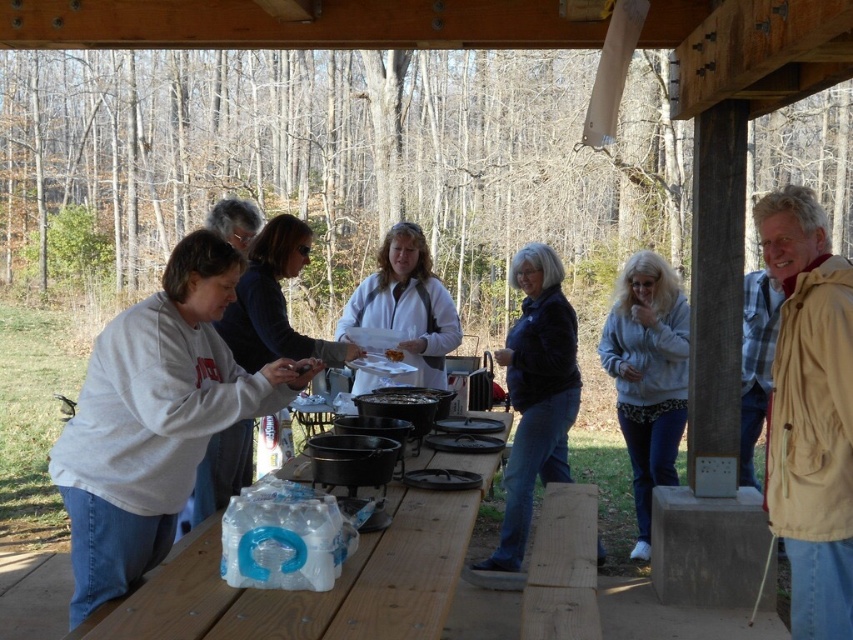
You are a person with a dark blue jacket at center. You want to reach the brown crumbly food at center. Can you do so without moving your feet?

The dark blue jacket at center and brown crumbly food at center are 35.62 inches apart. Since the distance is within typical arm reach, you can likely reach the brown crumbly food at center without moving your feet.

You are organizing a winter coat drive and need to determine which jackets can fit into a standard donation bin. The beige fabric jacket at right and the white matte jacket at center are both candidates. Based on their sizes, which one is more likely to fit into the bin?

The beige fabric jacket at right has a smaller size compared to the white matte jacket at center, so it is more likely to fit into the standard donation bin.